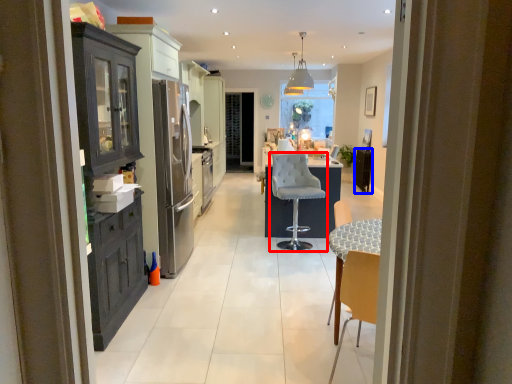
Question: Which point is further to the camera, chair (highlighted by a red box) or appliance (highlighted by a blue box)?

Choices:
 (A) chair
 (B) appliance

Answer: (B)